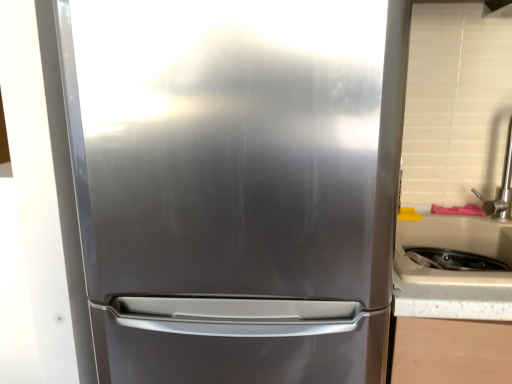
Question: From the image's perspective, is brushed metal exhaust hood at upper right above or below satin nickel faucet at right?

Choices:
 (A) above
 (B) below

Answer: (A)

Question: Choose the correct answer: Is brushed metal exhaust hood at upper right inside satin nickel faucet at right or outside it?

Choices:
 (A) inside
 (B) outside

Answer: (B)

Question: Which object is positioned farthest from the stainless steel refrigerator at center?

Choices:
 (A) white speckled laminate at right
 (B) satin nickel faucet at right
 (C) brushed metal exhaust hood at upper right

Answer: (C)

Question: Estimate the real-world distances between objects in this image. Which object is closer to the brushed metal exhaust hood at upper right?

Choices:
 (A) satin nickel faucet at right
 (B) white speckled laminate at right
 (C) stainless steel refrigerator at center

Answer: (A)